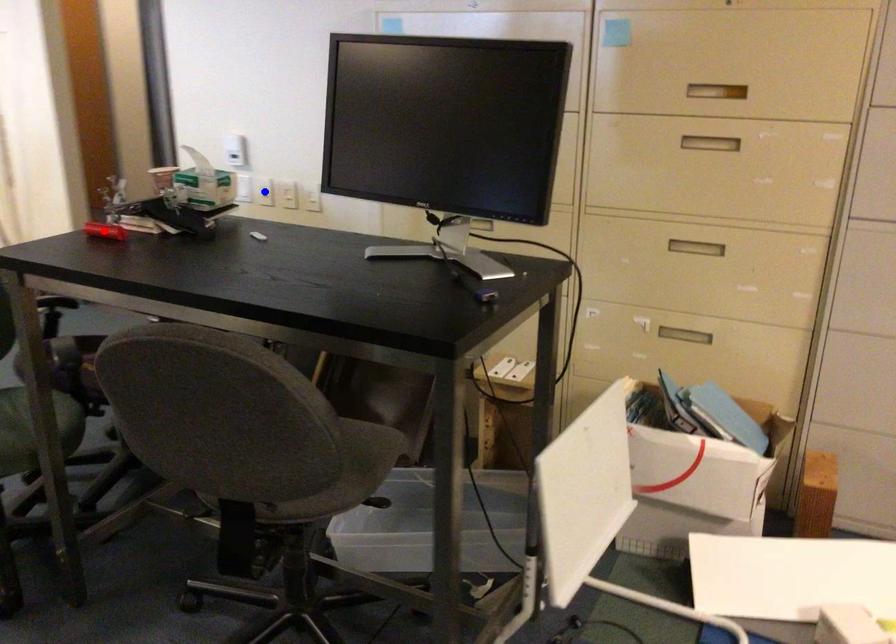
Question: In the image, two points are highlighted. Which point is nearer to the camera? Reply with the corresponding letter.

Choices:
 (A) blue point
 (B) red point

Answer: (B)